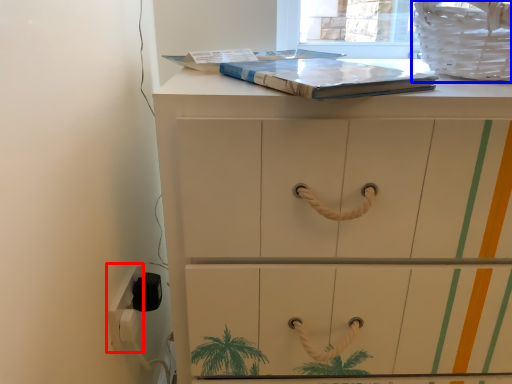
Question: Which object is closer to the camera taking this photo, electric outlet (highlighted by a red box) or laundry basket (highlighted by a blue box)?

Choices:
 (A) electric outlet
 (B) laundry basket

Answer: (B)